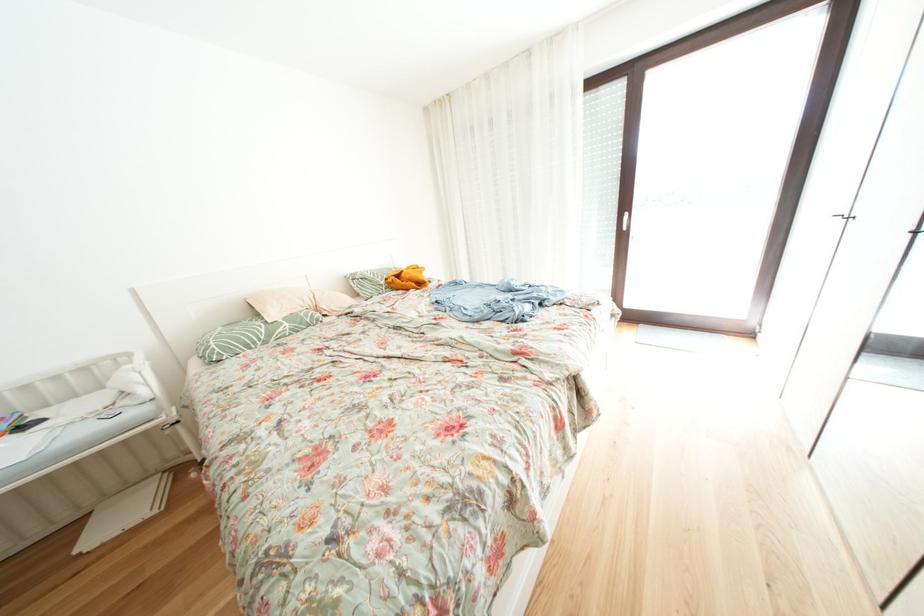
I want to click on green patterned pillow, so click(x=261, y=323).